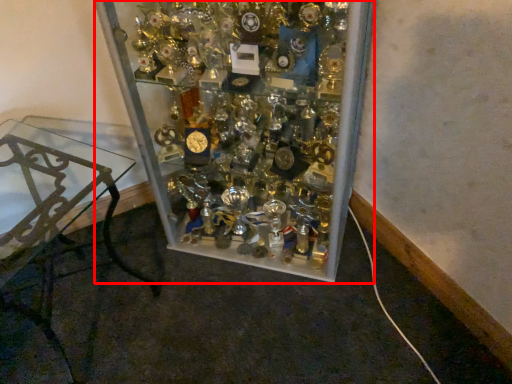
Question: From the image's perspective, what is the correct spatial relationship of glass box (annotated by the red box) in relation to furniture?

Choices:
 (A) above
 (B) below

Answer: (A)